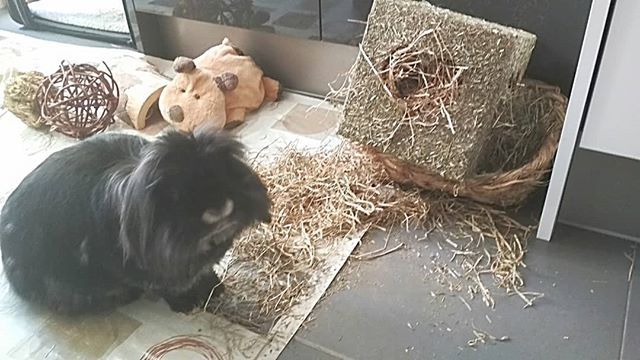
Identify the location of glass door bottom. The image size is (640, 360). (115, 19), (57, 9).